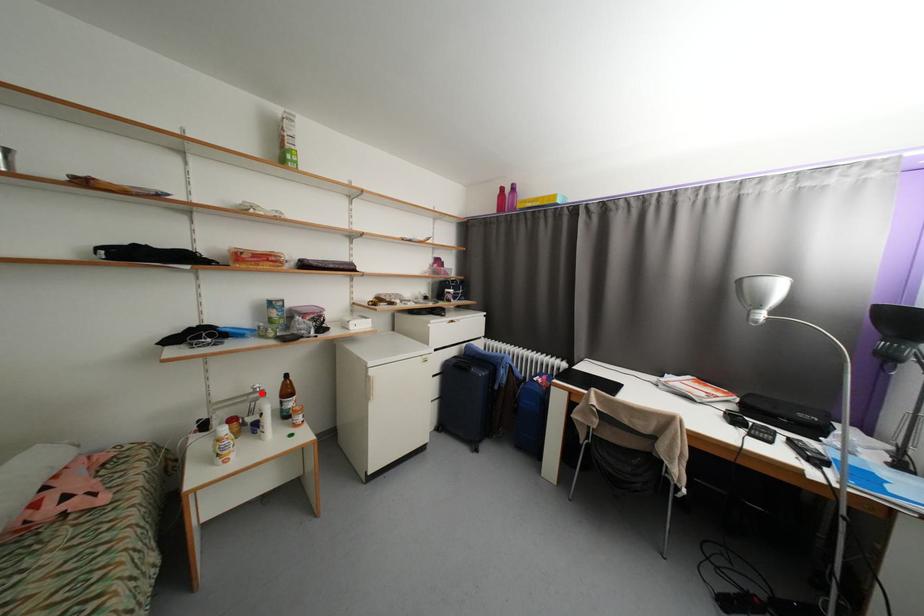
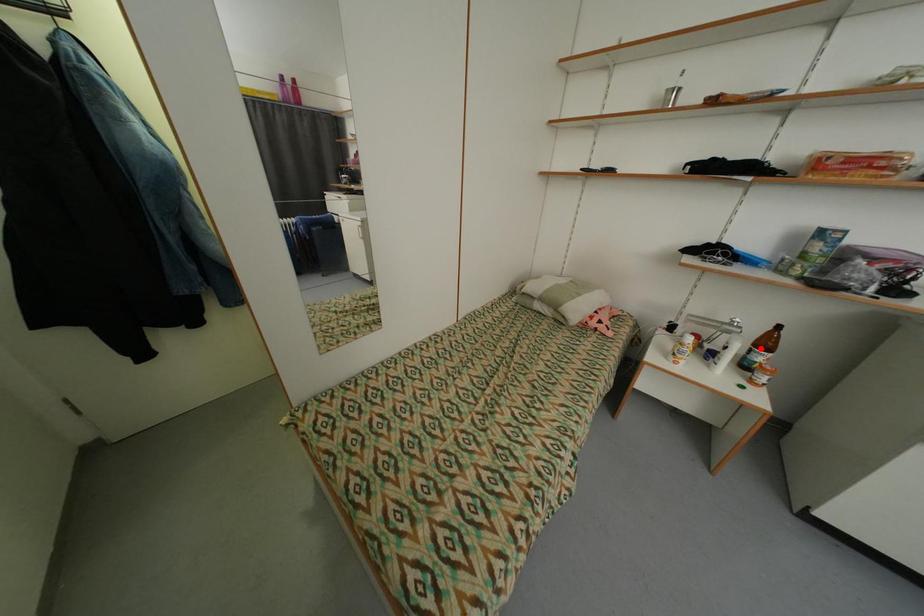
I am providing you with two images of the same scene from different viewpoints. A red point is marked on the first image and another point is marked on the second image. Do the highlighted points in image1 and image2 indicate the same real-world spot?

No